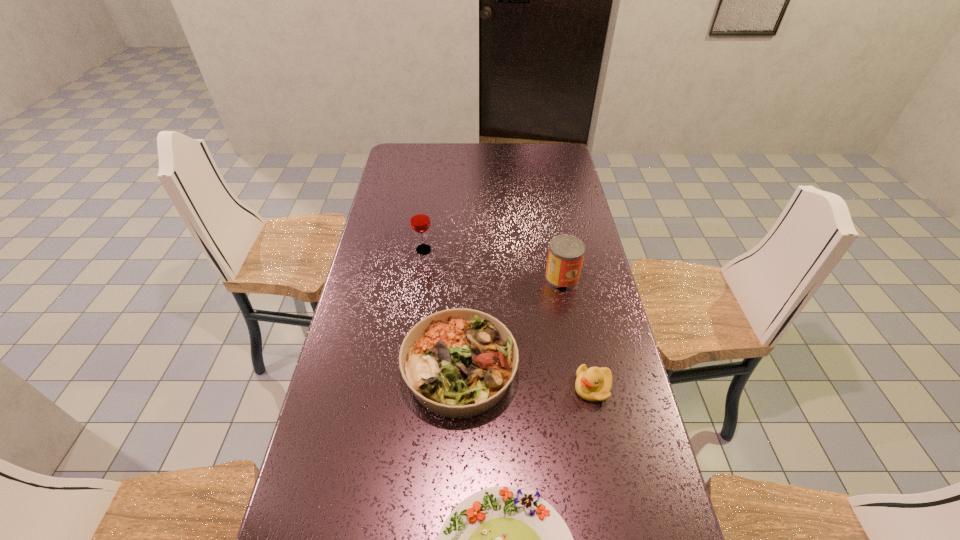
You are a GUI agent. You are given a task and a screenshot of the screen. Output one action in this format:
    pyautogui.click(x=<x>, y=<y>)
    Task: Click on the free area in between the second farthest object and the glass
    Image resolution: width=960 pixels, height=540 pixels.
    Given the screenshot: What is the action you would take?
    tap(492, 264)

This screenshot has width=960, height=540. Identify the location of empty space between the duckling and the glass. point(508,319).

What are the coordinates of `vacant space that is in between the farthest object and the fourth shortest object` in the screenshot? It's located at (492, 264).

Find the location of `free space between the glass and the farther salad plate`. free space between the glass and the farther salad plate is located at coordinates 442,310.

This screenshot has height=540, width=960. I want to click on free space between the second farthest object and the duckling, so click(577, 333).

At what (x,y) coordinates should I click in order to perform the action: click on free spot between the second tallest object and the duckling. Please return your answer as a coordinate pair (x, y). This screenshot has height=540, width=960. Looking at the image, I should click on (577, 333).

Identify which object is located as the nearest to the duckling. Please provide its 2D coordinates. Your answer should be formatted as a tuple, i.e. [(x, y)], where the tuple contains the x and y coordinates of a point satisfying the conditions above.

[(458, 363)]

Where is `object that is the fourth closest to the duckling`? The image size is (960, 540). object that is the fourth closest to the duckling is located at coordinates point(419,217).

Where is `free space that satisfies the following two spatial constraints: 1. on the front side of the can; 2. on the right side of the glass`? free space that satisfies the following two spatial constraints: 1. on the front side of the can; 2. on the right side of the glass is located at coordinates (420, 278).

I want to click on vacant region that satisfies the following two spatial constraints: 1. on the back side of the farther salad plate; 2. on the left side of the second farthest object, so click(x=464, y=278).